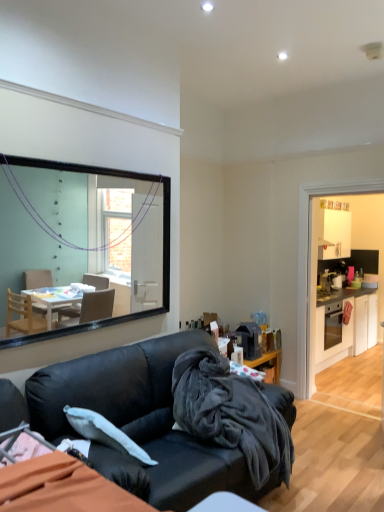
Question: From a real-world perspective, is white glossy cabinets at right positioned above or below velvety dark gray blanket at center?

Choices:
 (A) below
 (B) above

Answer: (A)

Question: Is point (360, 300) closer or farther from the camera than point (269, 448)?

Choices:
 (A) farther
 (B) closer

Answer: (A)

Question: Which object is positioned closest to the white glossy dresser at right?

Choices:
 (A) black leather couch at center
 (B) velvety dark gray blanket at center
 (C) white glossy cabinets at right

Answer: (C)

Question: Estimate the real-world distances between objects in this image. Which object is farther from the white glossy dresser at right?

Choices:
 (A) velvety dark gray blanket at center
 (B) white glossy cabinets at right
 (C) black leather couch at center

Answer: (C)